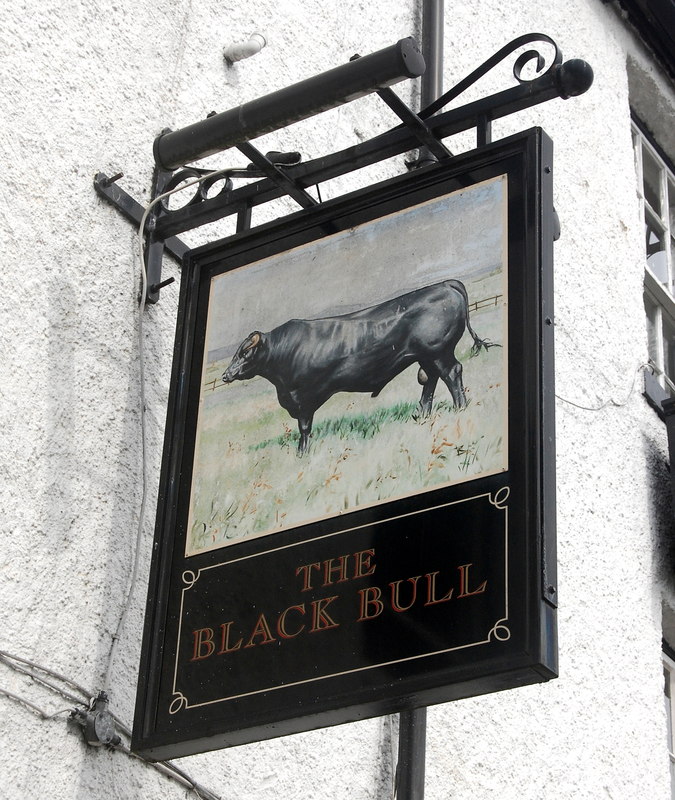
Where is `wires`? This screenshot has height=800, width=675. wires is located at coordinates (111, 666), (65, 676), (124, 746).